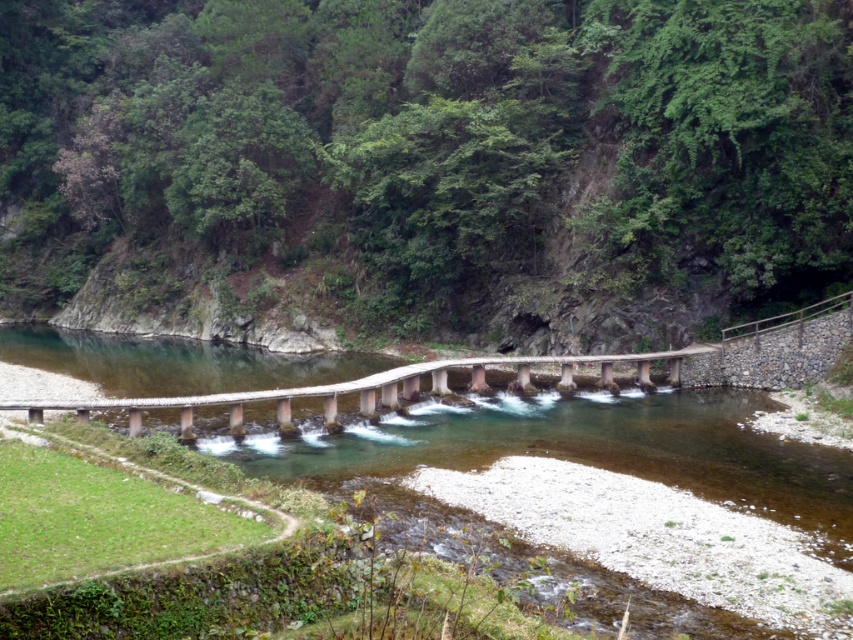
Please provide the coordinates of the green leafy hillside at upper center in the image.

The green leafy hillside at upper center is located at coordinates point (x=426, y=163).

Based on the photo, you are standing at the point marked as point (426, 163) in the image. What can you see around you?

The green leafy hillside at upper center is located at point (426, 163), so you can see the green leafy hillside around you.